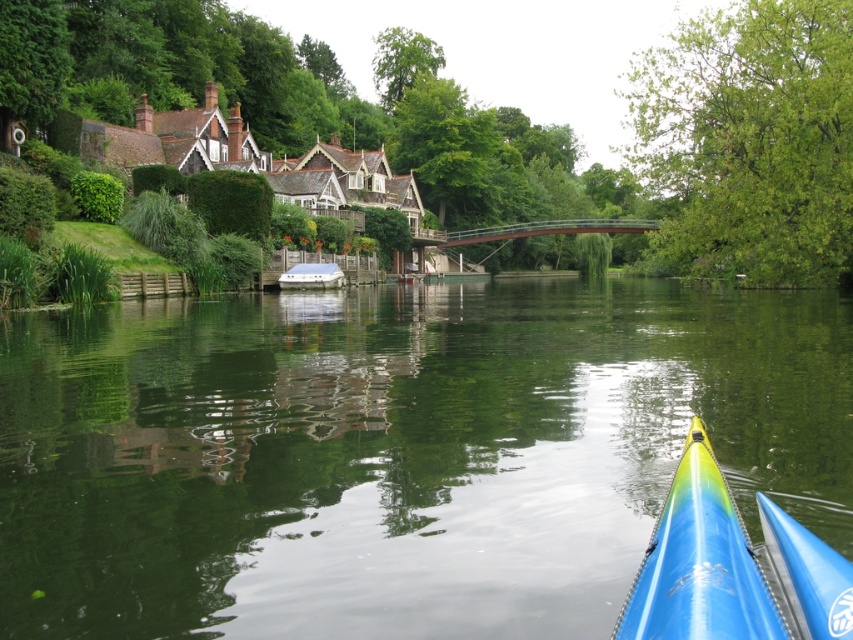
You are in a kayak and see the green smooth water at center and the white plastic boat at center. Which object is closer to you?

The green smooth water at center is closer to you because it is in front of the white plastic boat at center.